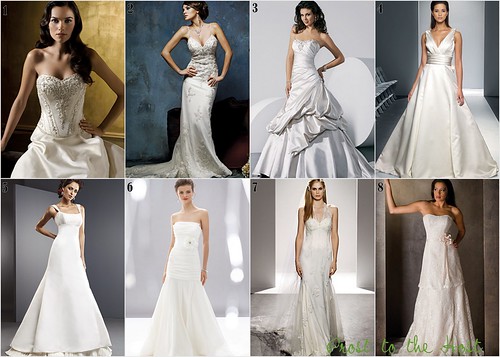
I want to click on photo with white folding chairs, so click(385, 88).